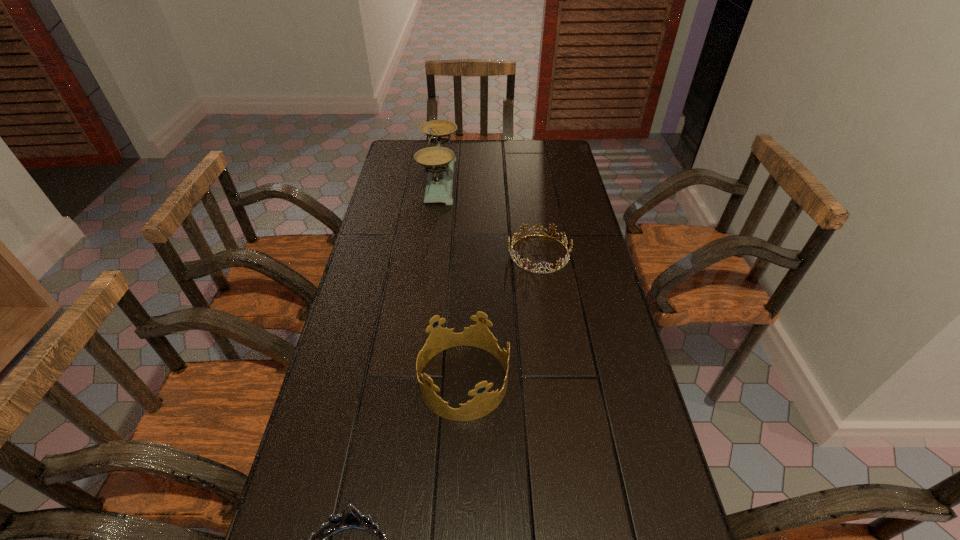
You are a GUI agent. You are given a task and a screenshot of the screen. Output one action in this format:
    pyautogui.click(x=<x>, y=<y>)
    Task: Click on the scale
    This screenshot has width=960, height=540.
    Given the screenshot: What is the action you would take?
    pyautogui.click(x=438, y=161)

I want to click on the farthest object, so click(438, 161).

In order to click on the second nearest object in this screenshot , I will do `click(478, 335)`.

At what (x,y) coordinates should I click in order to perform the action: click on the tallest tiara. Please return your answer as a coordinate pair (x, y). The width and height of the screenshot is (960, 540). Looking at the image, I should click on (478, 335).

Find the location of `the rightmost object`. the rightmost object is located at coordinates (514, 237).

In order to click on the third nearest object in this screenshot , I will do `click(514, 237)`.

Identify the location of vacant region located on the front-facing side of the scale. The image size is (960, 540). (510, 180).

Where is `vacant position located 0.070m on the front-facing side of the second nearest tiara`? The height and width of the screenshot is (540, 960). vacant position located 0.070m on the front-facing side of the second nearest tiara is located at coordinates (536, 381).

Find the location of a particular element. free space located on the front-facing side of the rightmost tiara is located at coordinates (420, 254).

Locate an element on the screen. The height and width of the screenshot is (540, 960). vacant space located 0.120m on the front-facing side of the rightmost tiara is located at coordinates (471, 254).